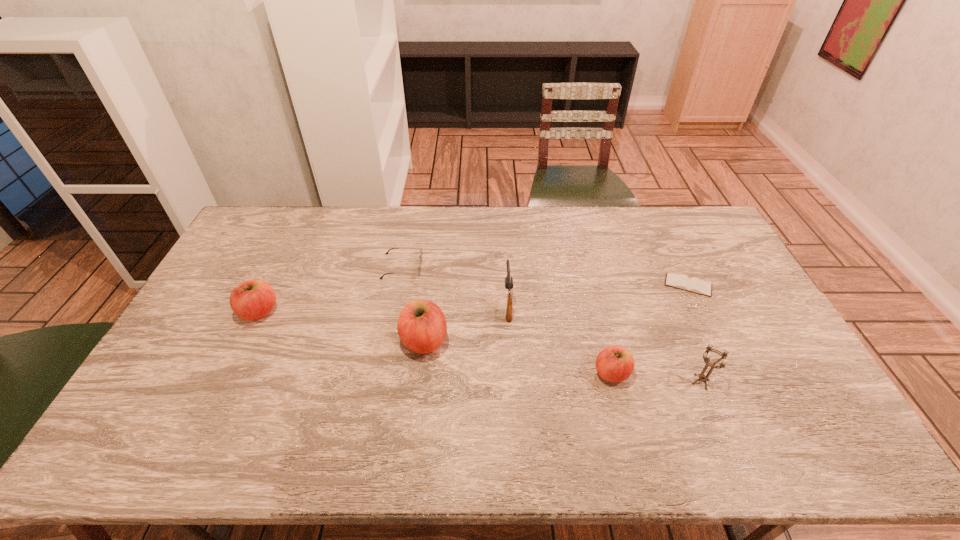
This screenshot has width=960, height=540. I want to click on free space between the candle holder and the third object from right to left, so click(x=656, y=377).

In order to click on vacant area that lies between the rightmost apple and the fourth object from right to left in this screenshot , I will do `click(560, 338)`.

Find the location of a particular element. empty space between the candle holder and the sixth tallest object is located at coordinates (551, 324).

Find the location of a particular element. This screenshot has height=540, width=960. free space between the sunglasses and the gun is located at coordinates (455, 284).

Identify which object is the fifth closest to the third object from right to left. Please provide its 2D coordinates. Your answer should be formatted as a tuple, i.e. [(x, y)], where the tuple contains the x and y coordinates of a point satisfying the conditions above.

[(420, 253)]

Locate an element on the screen. object that can be found as the fourth closest to the fourth object from left to right is located at coordinates (702, 377).

The width and height of the screenshot is (960, 540). What are the coordinates of `the closest apple to the second apple from left to right` in the screenshot? It's located at (254, 299).

The height and width of the screenshot is (540, 960). I want to click on apple that is the second closest to the leftmost object, so click(x=615, y=364).

This screenshot has width=960, height=540. I want to click on free space that satisfies the following two spatial constraints: 1. on the front-facing side of the candle holder; 2. on the left side of the second shortest object, so click(380, 382).

Where is `vacant point that satisfies the following two spatial constraints: 1. on the front-facing side of the shortest apple; 2. on the left side of the sixth tallest object`? This screenshot has height=540, width=960. vacant point that satisfies the following two spatial constraints: 1. on the front-facing side of the shortest apple; 2. on the left side of the sixth tallest object is located at coordinates (382, 373).